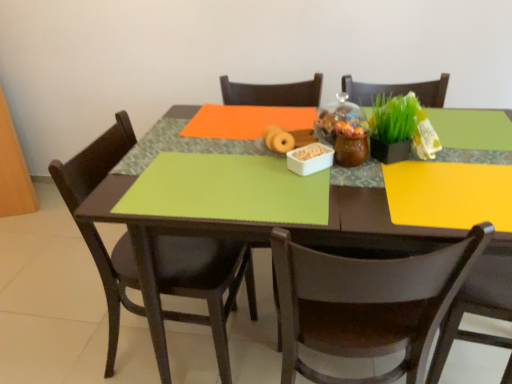
Question: Is there a large distance between matte black chair at left, which is the 2th chair in right-to-left order, and green matte placemat at center?

Choices:
 (A) yes
 (B) no

Answer: (B)

Question: From the image's perspective, is matte black chair at left, which ranks as the first chair in left-to-right order, located beneath green matte placemat at center?

Choices:
 (A) no
 (B) yes

Answer: (B)

Question: Does matte black chair at left, which ranks as the first chair in left-to-right order, appear on the right side of green matte placemat at center?

Choices:
 (A) no
 (B) yes

Answer: (A)

Question: Is matte black chair at left, which ranks as the first chair in left-to-right order, thinner than green matte placemat at center?

Choices:
 (A) no
 (B) yes

Answer: (A)

Question: Is matte black chair at left, which ranks as the first chair in left-to-right order, aimed at green matte placemat at center?

Choices:
 (A) no
 (B) yes

Answer: (B)

Question: Is matte black chair at left, which is the 2th chair in right-to-left order, at the left side of green matte placemat at center?

Choices:
 (A) no
 (B) yes

Answer: (B)

Question: Considering the relative sizes of green matte placemat at center and green matte table at center in the image provided, is green matte placemat at center bigger than green matte table at center?

Choices:
 (A) yes
 (B) no

Answer: (B)

Question: Is green matte placemat at center aimed at green matte table at center?

Choices:
 (A) yes
 (B) no

Answer: (A)

Question: From a real-world perspective, is green matte placemat at center positioned under green matte table at center based on gravity?

Choices:
 (A) yes
 (B) no

Answer: (B)

Question: From the image's perspective, is green matte placemat at center below green matte table at center?

Choices:
 (A) no
 (B) yes

Answer: (A)

Question: Considering the relative sizes of green matte placemat at center and green matte table at center in the image provided, is green matte placemat at center thinner than green matte table at center?

Choices:
 (A) yes
 (B) no

Answer: (A)

Question: Is green matte placemat at center smaller than green matte table at center?

Choices:
 (A) no
 (B) yes

Answer: (B)

Question: Would you say matte brown donut at center is part of brown wooden chair at lower right, the 1th chair when ordered from right to left,'s contents?

Choices:
 (A) yes
 (B) no

Answer: (B)